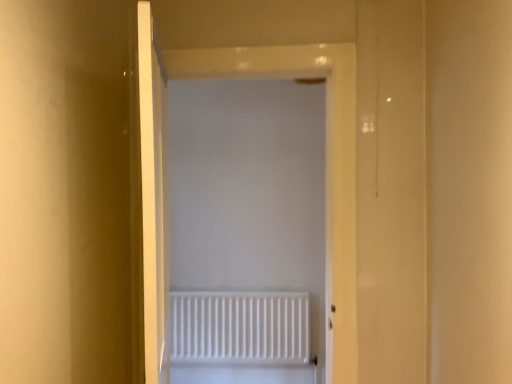
Question: Considering the relative positions of white matte radiator at center and white matte radiator at center in the image provided, is white matte radiator at center to the left of white matte radiator at center from the viewer's perspective?

Choices:
 (A) no
 (B) yes

Answer: (A)

Question: From a real-world perspective, is white matte radiator at center on white matte radiator at center?

Choices:
 (A) yes
 (B) no

Answer: (A)

Question: Is white matte radiator at center shorter than white matte radiator at center?

Choices:
 (A) no
 (B) yes

Answer: (A)

Question: From a real-world perspective, is white matte radiator at center beneath white matte radiator at center?

Choices:
 (A) yes
 (B) no

Answer: (B)

Question: Considering the relative sizes of white matte radiator at center and white matte radiator at center in the image provided, is white matte radiator at center thinner than white matte radiator at center?

Choices:
 (A) no
 (B) yes

Answer: (A)

Question: Is white matte radiator at center not within white matte radiator at center?

Choices:
 (A) yes
 (B) no

Answer: (A)

Question: Can you confirm if white matte radiator at center is shorter than white matte radiator at center?

Choices:
 (A) no
 (B) yes

Answer: (B)

Question: Can you confirm if white matte radiator at center is taller than white matte radiator at center?

Choices:
 (A) yes
 (B) no

Answer: (B)

Question: From a real-world perspective, is white matte radiator at center located beneath white matte radiator at center?

Choices:
 (A) yes
 (B) no

Answer: (A)

Question: Is white matte radiator at center aimed at white matte radiator at center?

Choices:
 (A) no
 (B) yes

Answer: (A)

Question: Is white matte radiator at center oriented away from white matte radiator at center?

Choices:
 (A) yes
 (B) no

Answer: (B)

Question: Is white matte radiator at center a part of white matte radiator at center?

Choices:
 (A) no
 (B) yes

Answer: (A)

Question: In the image, is white matte radiator at center on the left side or the right side of white matte radiator at center?

Choices:
 (A) left
 (B) right

Answer: (A)